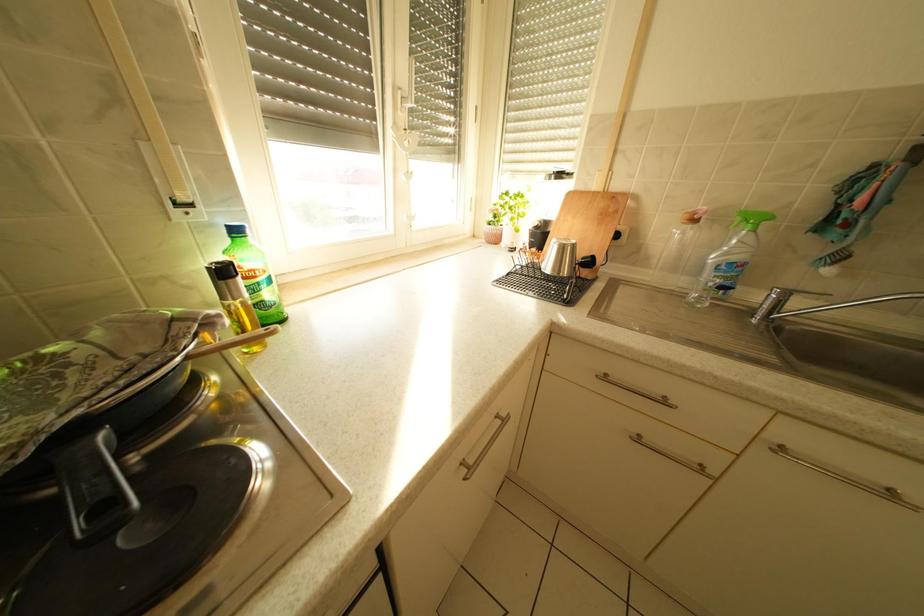
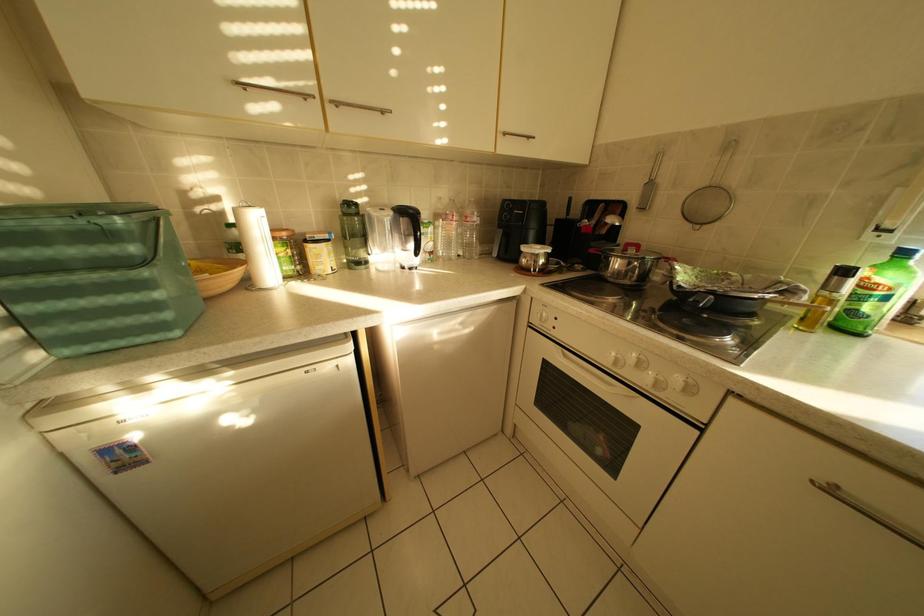
The first image is from the beginning of the video and the second image is from the end. How did the camera likely rotate when shooting the video?

The camera rotated toward left-down.